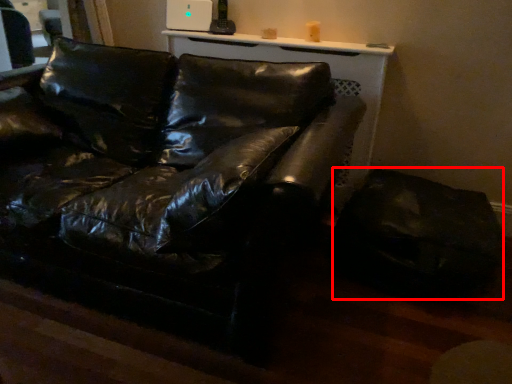
Question: From the image's perspective, what is the correct spatial positioning of swivel chair (annotated by the red box) in reference to studio couch?

Choices:
 (A) above
 (B) below

Answer: (B)